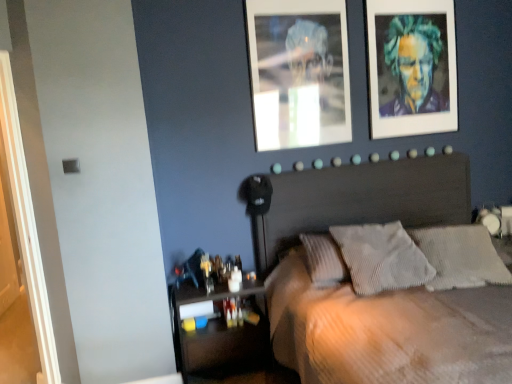
Question: Do you think gray corduroy pillow at center, which is the 2th pillow from left to right, is within gray corduroy pillow at center, which ranks as the first pillow in left-to-right order, or outside of it?

Choices:
 (A) inside
 (B) outside

Answer: (B)

Question: Is gray corduroy pillow at center, which is the 2th pillow from left to right, bigger or smaller than gray corduroy pillow at center, which is the second pillow from right to left?

Choices:
 (A) big
 (B) small

Answer: (B)

Question: Which object is positioned closest to the multicolored textured portrait at upper right?

Choices:
 (A) translucent plastic shelf at lower left
 (B) white painted wood door at left
 (C) gray corduroy pillow at center, which is the 1th pillow from right to left
 (D) wooden bed at center
 (E) gray corduroy pillow at center, which is the second pillow from right to left

Answer: (D)

Question: Estimate the real-world distances between objects in this image. Which object is farther from the metallic silver photo frame at upper center?

Choices:
 (A) multicolored textured portrait at upper right
 (B) wooden bed at center
 (C) gray corduroy pillow at center, which is the 1th pillow from right to left
 (D) white painted wood door at left
 (E) translucent plastic shelf at lower left

Answer: (D)